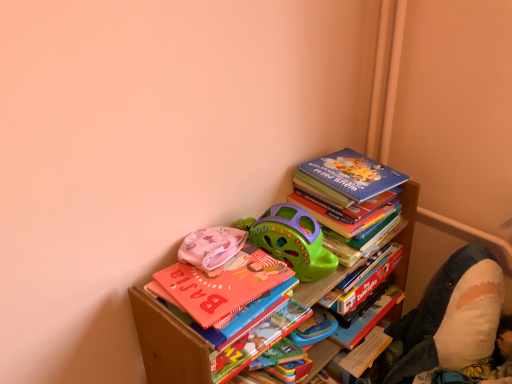
Question: Does hardcover book at upper right, positioned as the 1th paperback book in top-to-bottom order, have a smaller size compared to wooden bookcase at upper right?

Choices:
 (A) yes
 (B) no

Answer: (A)

Question: Can you confirm if hardcover book at upper right, which appears as the second paperback book when ordered from the bottom, is positioned to the left of wooden bookcase at upper right?

Choices:
 (A) yes
 (B) no

Answer: (B)

Question: Does hardcover book at upper right, which appears as the second paperback book when ordered from the bottom, have a lesser width compared to wooden bookcase at upper right?

Choices:
 (A) no
 (B) yes

Answer: (B)

Question: Is hardcover book at upper right, which appears as the second paperback book when ordered from the bottom, not near wooden bookcase at upper right?

Choices:
 (A) no
 (B) yes

Answer: (A)

Question: Can you confirm if hardcover book at upper right, the 2th paperback book from the left, is taller than wooden bookcase at upper right?

Choices:
 (A) yes
 (B) no

Answer: (B)

Question: Is the position of hardcover book at upper right, which appears as the second paperback book when ordered from the bottom, less distant than that of wooden bookcase at upper right?

Choices:
 (A) no
 (B) yes

Answer: (A)

Question: Is blue matte book at upper right looking in the opposite direction of multicolored paper at center, which is the 1th paperback book in left-to-right order?

Choices:
 (A) no
 (B) yes

Answer: (A)

Question: From the image's perspective, is blue matte book at upper right located beneath multicolored paper at center, the first paperback book in the bottom-to-top sequence?

Choices:
 (A) no
 (B) yes

Answer: (A)

Question: Does blue matte book at upper right have a greater width compared to multicolored paper at center, acting as the second paperback book starting from the top?

Choices:
 (A) no
 (B) yes

Answer: (A)

Question: Would you consider blue matte book at upper right to be distant from multicolored paper at center, marked as the 2th paperback book in a right-to-left arrangement?

Choices:
 (A) no
 (B) yes

Answer: (A)

Question: Is blue matte book at upper right aimed at multicolored paper at center, acting as the second paperback book starting from the top?

Choices:
 (A) yes
 (B) no

Answer: (B)

Question: Does blue matte book at upper right have a lesser width compared to multicolored paper at center, the first paperback book in the bottom-to-top sequence?

Choices:
 (A) yes
 (B) no

Answer: (A)

Question: Could you tell me if green plastic toy car at upper center, which is the second toy from right to left, is facing multicolored paper at center, which is the 1th paperback book in left-to-right order?

Choices:
 (A) no
 (B) yes

Answer: (A)